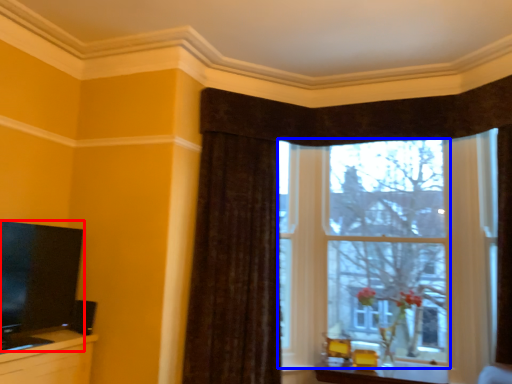
Question: Which of the following is the closest to the observer, television (highlighted by a red box) or window (highlighted by a blue box)?

Choices:
 (A) television
 (B) window

Answer: (A)